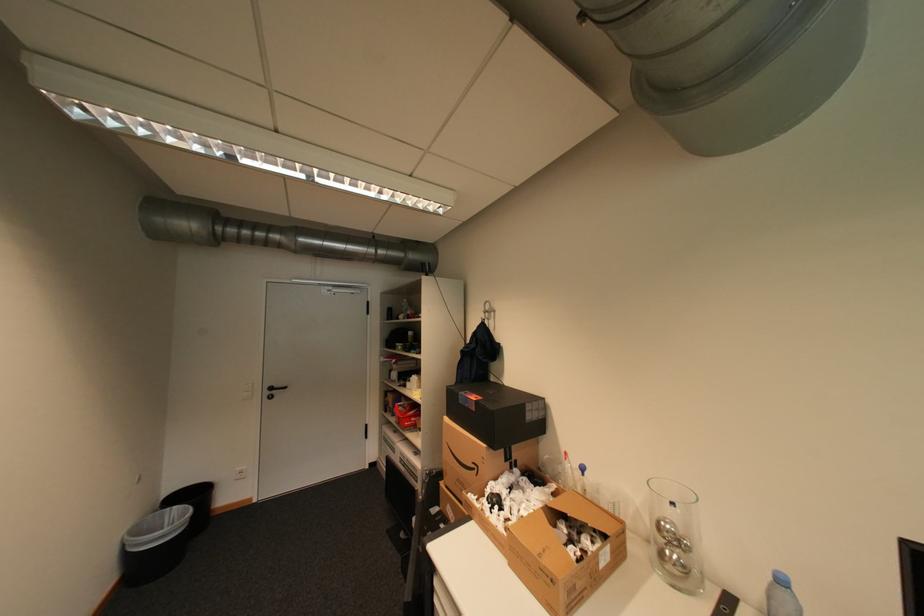
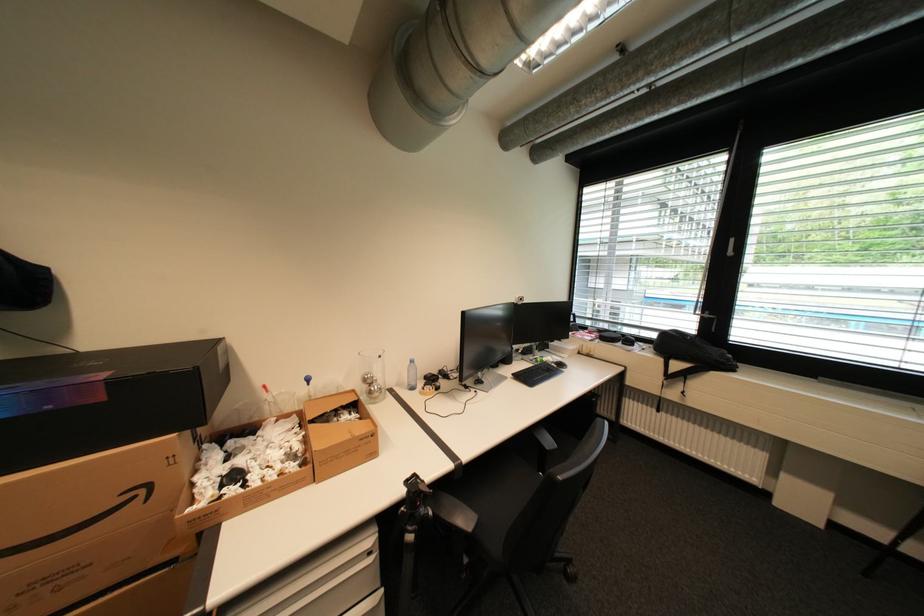
Where in the second image is the point corresponding to [673,527] from the first image?

(377, 378)